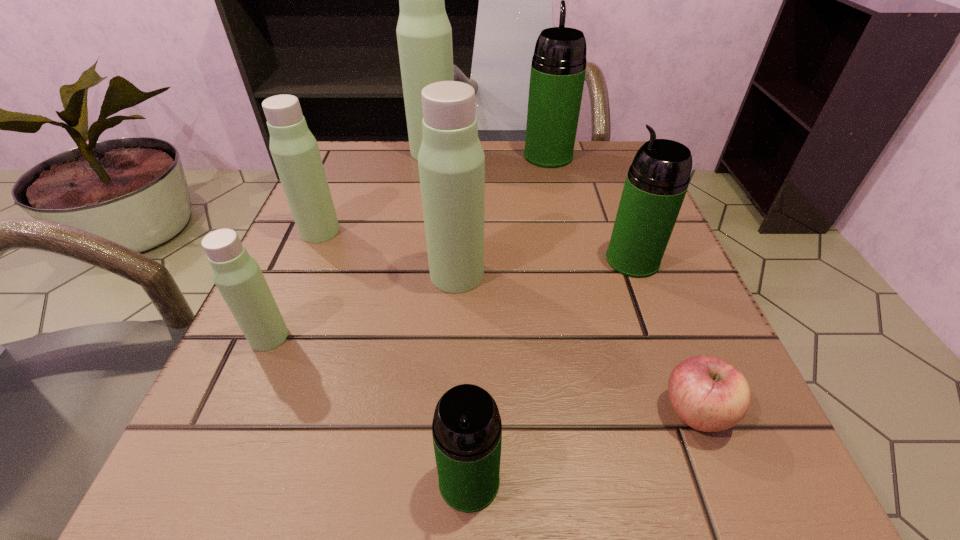
You are a GUI agent. You are given a task and a screenshot of the screen. Output one action in this format:
    pyautogui.click(x=<x>, y=<y>)
    Task: Click on the vacant region that satisfies the following two spatial constraints: 1. from the spout of the apple; 2. on the right side of the rightmost thermos bottle
    The height and width of the screenshot is (540, 960).
    Given the screenshot: What is the action you would take?
    tap(689, 413)

The image size is (960, 540). I want to click on free space that satisfies the following two spatial constraints: 1. on the back side of the farthest light thermos bottle; 2. on the right side of the second farthest light thermos bottle, so click(x=353, y=152).